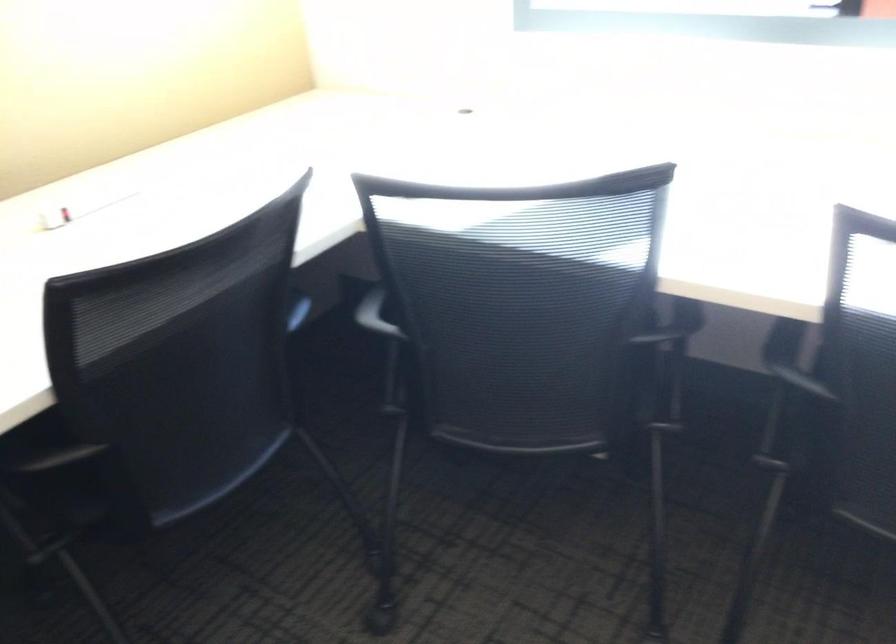
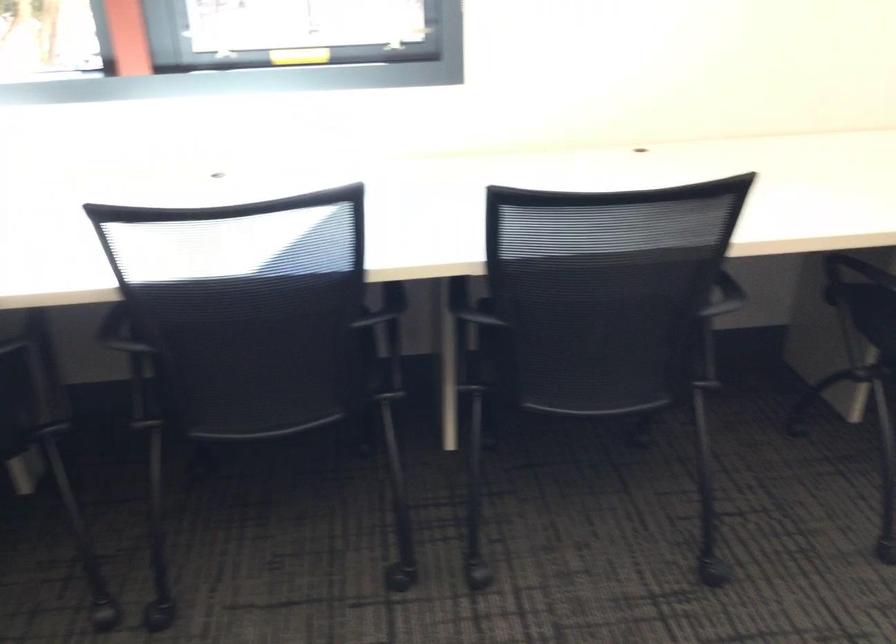
Question: How did the camera likely rotate?

Choices:
 (A) Left
 (B) Right
 (C) Up
 (D) Down

Answer: (B)